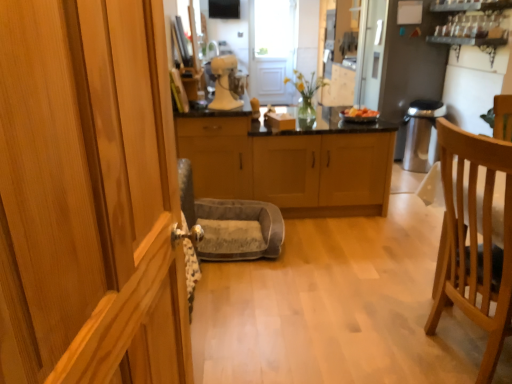
At what (x,y) coordinates should I click in order to perform the action: click on free space to the left of light brown wooden chair at right. Please return your answer as a coordinate pair (x, y). The height and width of the screenshot is (384, 512). Looking at the image, I should click on tap(364, 338).